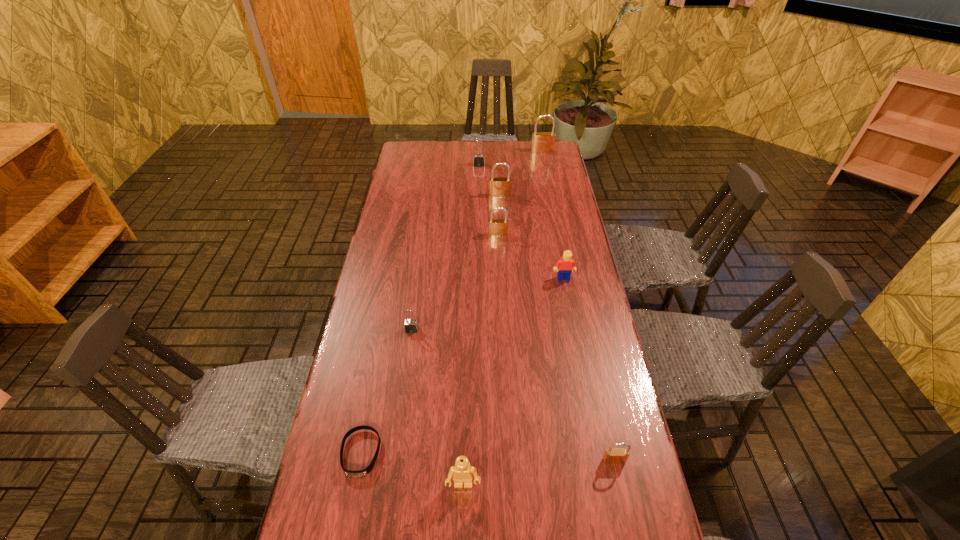
Where is `the farthest object`? the farthest object is located at coordinates (542, 142).

Where is `the tallest object`? Image resolution: width=960 pixels, height=540 pixels. the tallest object is located at coordinates (542, 142).

The height and width of the screenshot is (540, 960). What are the coordinates of `the second tallest object` in the screenshot? It's located at (499, 187).

Where is `the third nearest brass padlock`? the third nearest brass padlock is located at coordinates (499, 187).

The image size is (960, 540). I want to click on the eighth nearest object, so click(478, 160).

Find the location of `the right gray padlock`. the right gray padlock is located at coordinates (478, 160).

Where is `the fourth farthest padlock`? The image size is (960, 540). the fourth farthest padlock is located at coordinates (497, 227).

You are a GUI agent. You are given a task and a screenshot of the screen. Output one action in this format:
    pyautogui.click(x=<x>, y=<y>)
    Task: Click on the third farthest brass padlock
    The height and width of the screenshot is (540, 960).
    Given the screenshot: What is the action you would take?
    pyautogui.click(x=497, y=227)

I want to click on the farther Lego, so click(x=566, y=264).

In order to click on the fifth farthest object in this screenshot , I will do `click(566, 264)`.